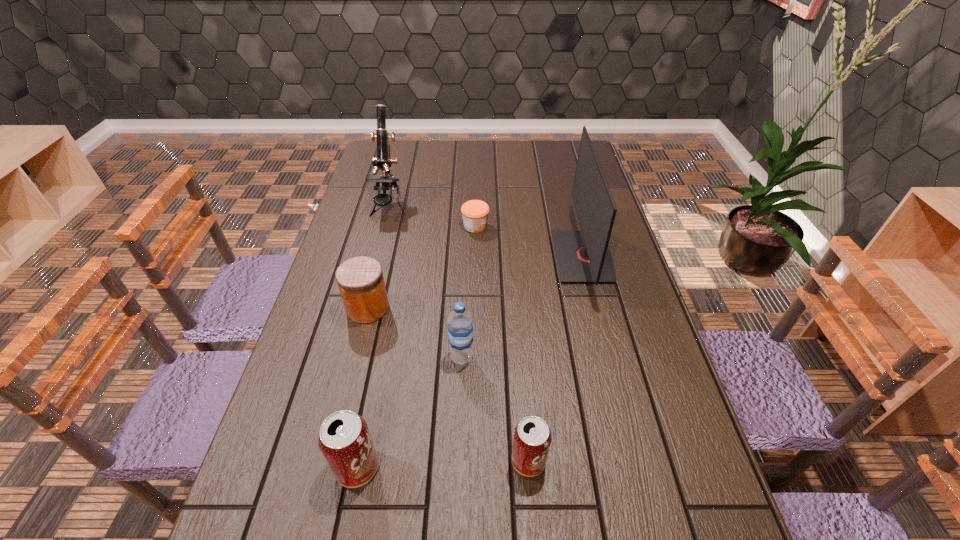
Identify the location of vacant space located 0.400m through the eyepiece of the microscope. Image resolution: width=960 pixels, height=540 pixels. (362, 315).

Identify the location of vacant region located 0.150m on the front label of the jam. The width and height of the screenshot is (960, 540). (534, 226).

Locate an element on the screen. free space located on the label of the water bottle is located at coordinates (457, 496).

Locate an element on the screen. Image resolution: width=960 pixels, height=540 pixels. vacant space located 0.150m on the right of the jar is located at coordinates (444, 308).

This screenshot has width=960, height=540. I want to click on vacant space located on the screen side of the rightmost object, so click(x=503, y=256).

The height and width of the screenshot is (540, 960). I want to click on vacant region located 0.140m on the screen side of the rightmost object, so click(x=510, y=256).

Find the location of a particular element. This screenshot has height=540, width=960. free location located 0.260m on the screen side of the rightmost object is located at coordinates (471, 256).

The image size is (960, 540). I want to click on soda can that is at the left edge, so click(x=345, y=441).

Find the location of a particular element. This screenshot has width=960, height=540. microscope that is at the left edge is located at coordinates pos(383,161).

Locate an element on the screen. This screenshot has height=540, width=960. jar situated at the left edge is located at coordinates (360, 280).